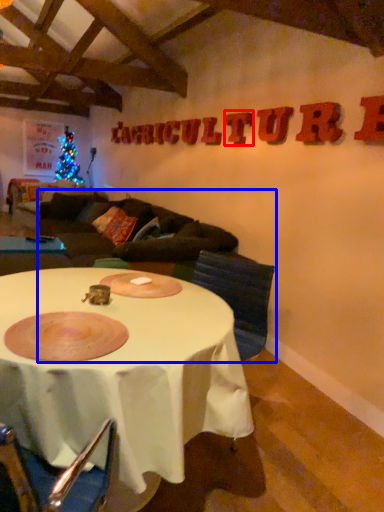
Question: Which object appears farthest to the camera in this image, letter (highlighted by a red box) or couch (highlighted by a blue box)?

Choices:
 (A) letter
 (B) couch

Answer: (A)